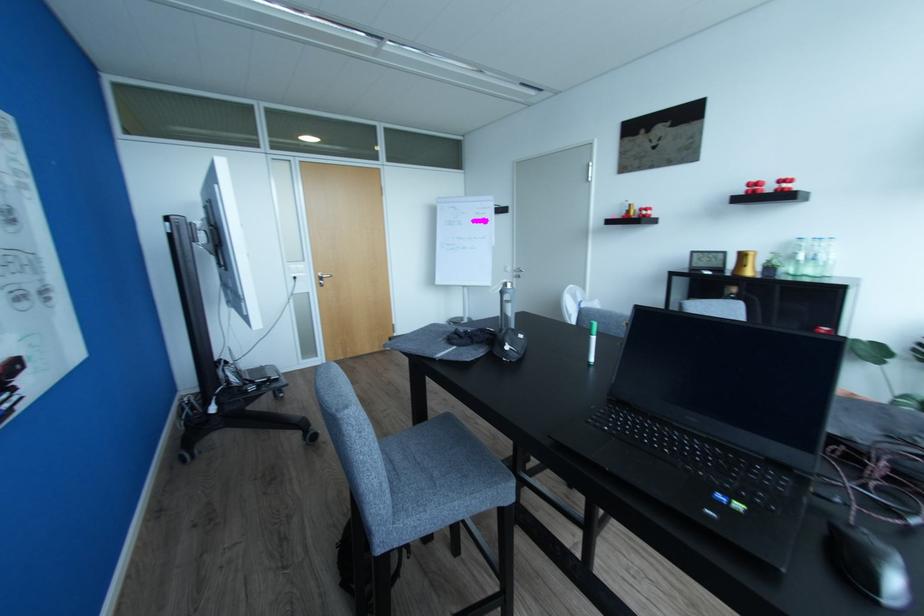
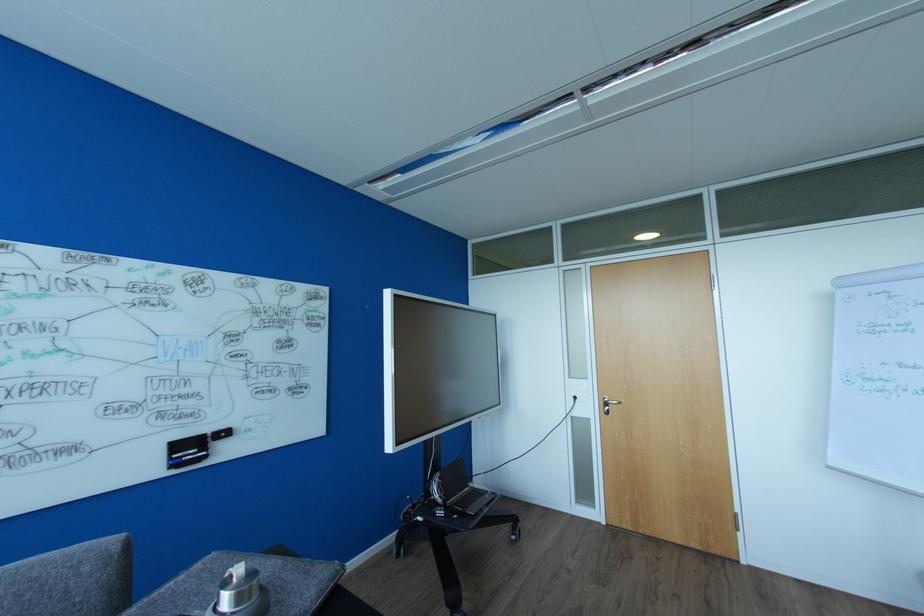
Find the pixel in the second image that matches point 299,278 in the first image.

(578, 398)